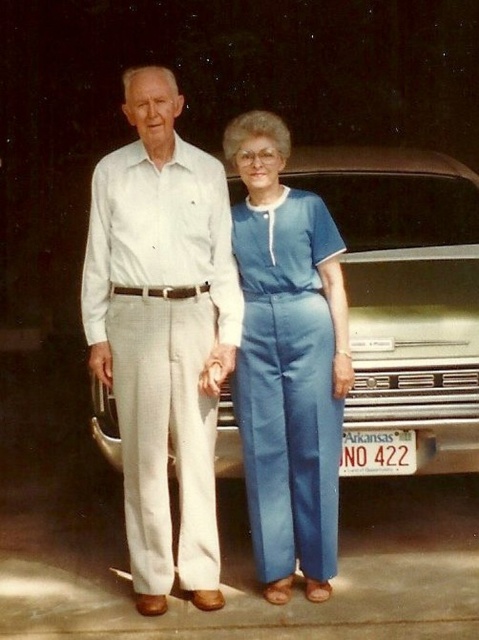
You are a photographer trying to capture a group photo of the metallic silver car at center and the blue cotton jumpsuit at center. Since you want to ensure both subjects are visible, which one should you position closer to the camera to avoid being blocked by the other?

The blue cotton jumpsuit at center should be positioned closer to the camera because the metallic silver car at center is to the right of it, so moving the jumpsuit forward would prevent the car from blocking it.

Consider the image. You are a photographer trying to adjust the lighting for a photo shoot. You notice the white cotton pants at center and the blue cotton jumpsuit at center. Which clothing item requires more upward adjustment of the lighting equipment to ensure proper exposure, considering their height differences?

The white cotton pants at center is taller than the blue cotton jumpsuit at center, so the lighting equipment should be adjusted higher to properly illuminate the white cotton pants at center.